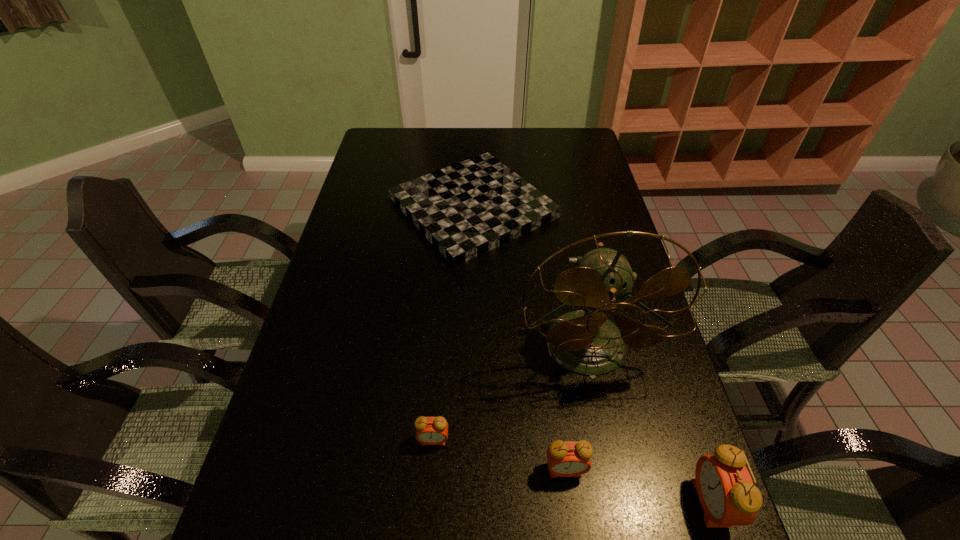
Where is `object that is at the near right corner`? The width and height of the screenshot is (960, 540). object that is at the near right corner is located at coordinates (725, 488).

Where is `vacant space at the far edge of the desktop`? The width and height of the screenshot is (960, 540). vacant space at the far edge of the desktop is located at coordinates (416, 129).

Find the location of a particular element. Image resolution: width=960 pixels, height=540 pixels. free space at the near edge is located at coordinates (482, 486).

The image size is (960, 540). Find the location of `blank space at the left edge of the desktop`. blank space at the left edge of the desktop is located at coordinates coord(313,354).

Image resolution: width=960 pixels, height=540 pixels. Identify the location of vacant space at the right edge. (647, 436).

Locate an element on the screen. Image resolution: width=960 pixels, height=540 pixels. vacant space at the far left corner of the desktop is located at coordinates tap(378, 154).

Where is `vacant area that lies between the checkerboard and the tallest object`? vacant area that lies between the checkerboard and the tallest object is located at coordinates (530, 277).

Identify the location of free area in between the third farthest object and the tallest object. This screenshot has height=540, width=960. (510, 393).

Locate an element on the screen. empty space between the third farthest object and the checkerboard is located at coordinates (453, 324).

Locate an element on the screen. This screenshot has height=540, width=960. vacant space that's between the checkerboard and the tallest object is located at coordinates (530, 277).